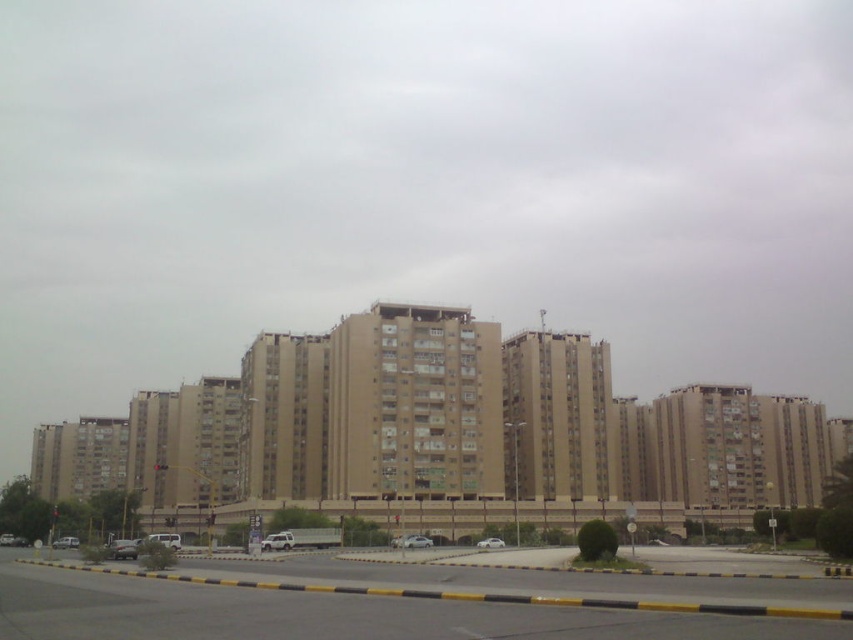
Question: Is silver metallic car at center below silver metallic van at lower left?

Choices:
 (A) no
 (B) yes

Answer: (A)

Question: Which point is closer to the camera?

Choices:
 (A) (477, 545)
 (B) (276, 540)
 (C) (154, 541)
 (D) (114, 545)

Answer: (C)

Question: Can you confirm if silver metallic car at lower left is bigger than white matte car at center?

Choices:
 (A) no
 (B) yes

Answer: (B)

Question: From the image, what is the correct spatial relationship of silver metallic car at lower left in relation to white matte car at center?

Choices:
 (A) right
 (B) left

Answer: (B)

Question: Which point is farther to the camera?

Choices:
 (A) (480, 545)
 (B) (107, 547)

Answer: (A)

Question: Which object is farther from the camera taking this photo?

Choices:
 (A) white glossy sedan at center
 (B) silver metallic car at center
 (C) silver metallic van at lower left
 (D) silver metallic van at center

Answer: (C)